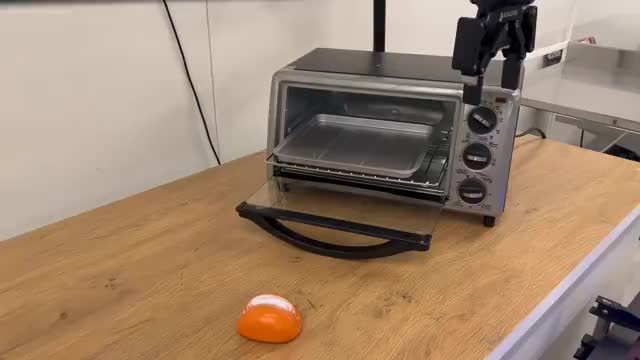
You are a GUI agent. You are given a task and a screenshot of the screen. Output one action in this format:
    pyautogui.click(x=<x>, y=<y>)
    Task: Click on the tables
    Image resolution: width=640 pixels, height=360 pixels.
    Given the screenshot: What is the action you would take?
    pyautogui.click(x=500, y=277), pyautogui.click(x=598, y=86)